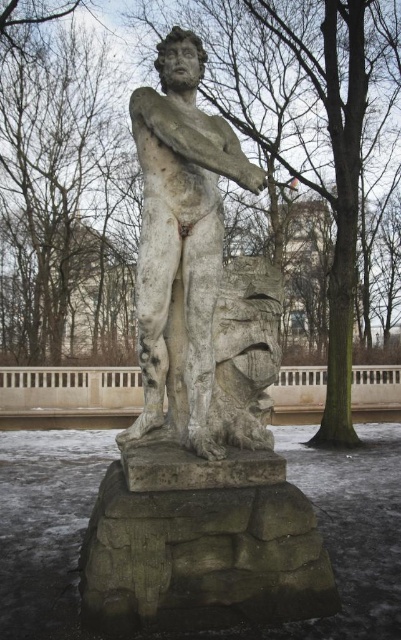
Is bare branches at upper left smaller than stone statue at center?

Actually, bare branches at upper left might be larger than stone statue at center.

Between bare branches at upper left and stone statue at center, which one has less height?

stone statue at center is shorter.

From the picture: Who is more forward, (87, 346) or (194, 225)?

Point (194, 225) is in front.

The image size is (401, 640). Identify the location of bare branches at upper left. (64, 198).